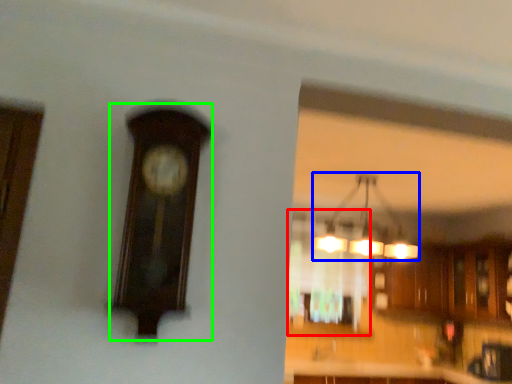
Question: Estimate the real-world distances between objects in this image. Which object is closer to window (highlighted by a red box), lamp (highlighted by a blue box) or clock (highlighted by a green box)?

Choices:
 (A) lamp
 (B) clock

Answer: (A)